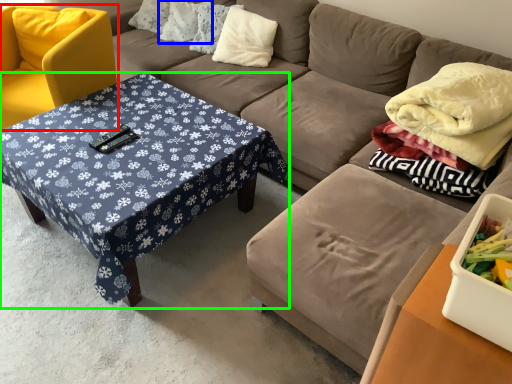
Question: Estimate the real-world distances between objects in this image. Which object is farther from chair (highlighted by a red box), pillow (highlighted by a blue box) or coffee table (highlighted by a green box)?

Choices:
 (A) pillow
 (B) coffee table

Answer: (A)